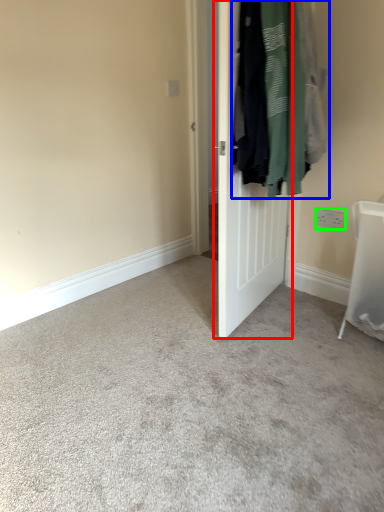
Question: Which object is the farthest from door (highlighted by a red box)? Choose among these: laundry (highlighted by a blue box) or electric outlet (highlighted by a green box).

Choices:
 (A) laundry
 (B) electric outlet

Answer: (B)